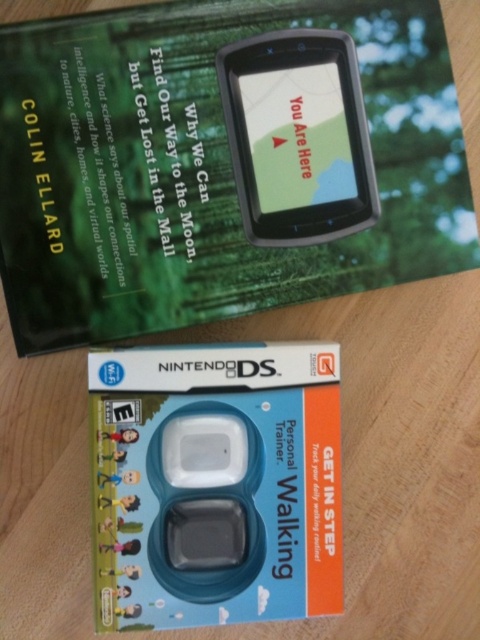
Question: Does blue plastic nintendo ds at center appear over black plastic gps at upper center?

Choices:
 (A) yes
 (B) no

Answer: (B)

Question: Is blue plastic nintendo ds at center wider than black plastic gps at upper center?

Choices:
 (A) yes
 (B) no

Answer: (A)

Question: Which object appears farthest from the camera in this image?

Choices:
 (A) blue plastic nintendo ds at center
 (B) black plastic gps at upper center

Answer: (B)

Question: Can you confirm if blue plastic nintendo ds at center is bigger than black plastic gps at upper center?

Choices:
 (A) no
 (B) yes

Answer: (B)